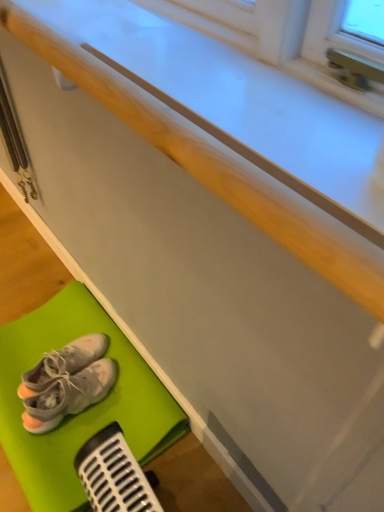
Identify the location of free spot behind white fabric sneakers at lower left, which appears as the second footwear when viewed from the top. (77, 330).